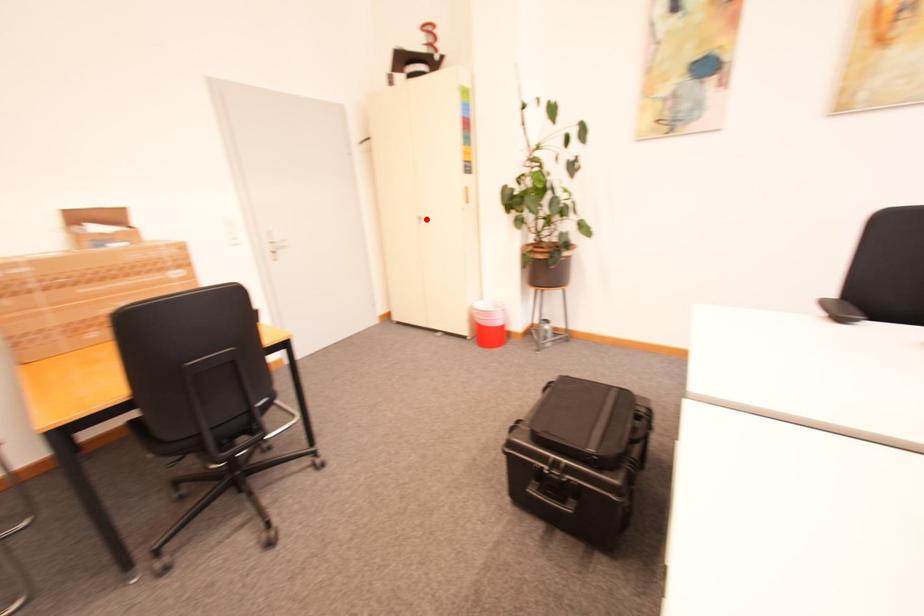
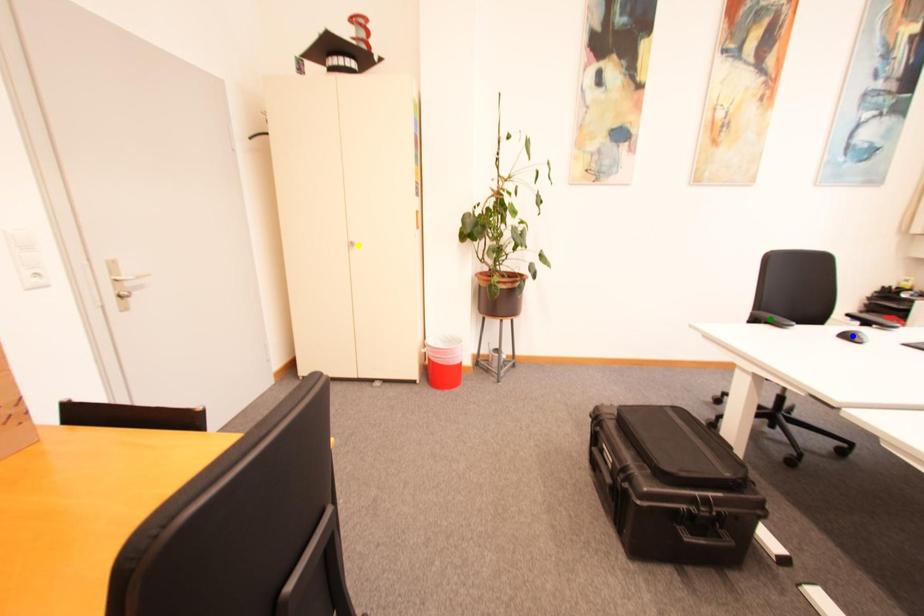
Question: I am providing you with two images of the same scene from different viewpoints. A red point is marked on the first image. You are given multiple points on the second image. In image 2, which mark is for the same physical point as the one in image 1?

Choices:
 (A) blue point
 (B) green point
 (C) yellow point

Answer: (C)